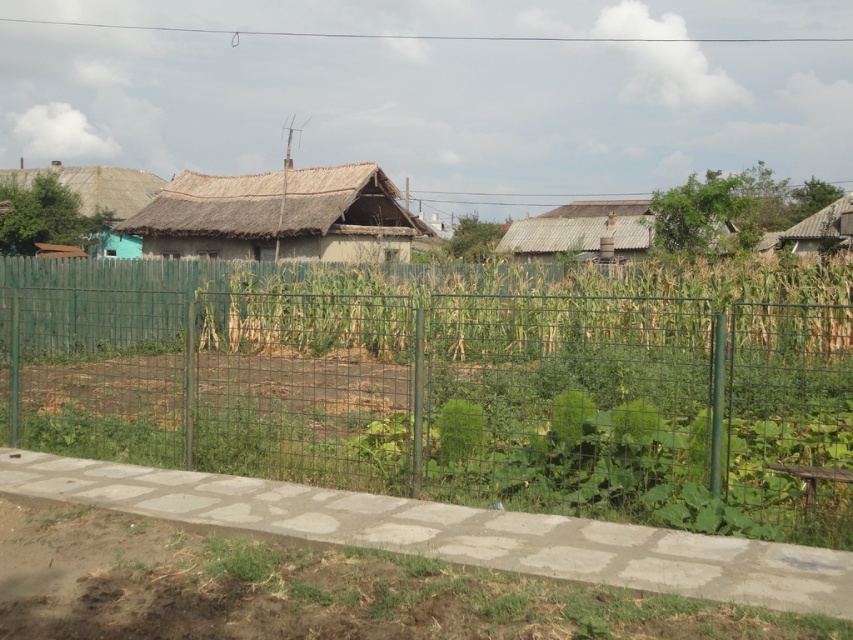
Looking at this image, you are standing in the rural scene and want to determine which of the two points, point (x=166, y=244) or point (x=621, y=253), is closer to you. Based on the scene description, which point is nearer?

Point (x=166, y=244) is closer to the viewer than point (x=621, y=253).

You are standing in the middle of the garden enclosed by the green wire mesh fence at center and want to look towards the brown thatched hut at upper right. In which direction should you turn your head?

The green wire mesh fence at center is to the left of the brown thatched hut at upper right, so you should turn your head to the right to face the brown thatched hut at upper right.

You are standing in the middle of a rural area and see the green wire mesh fence at center and the rusty corrugated metal hut at center. Which object is positioned to the left side from your viewpoint?

The green wire mesh fence at center is to the left of the rusty corrugated metal hut at center.